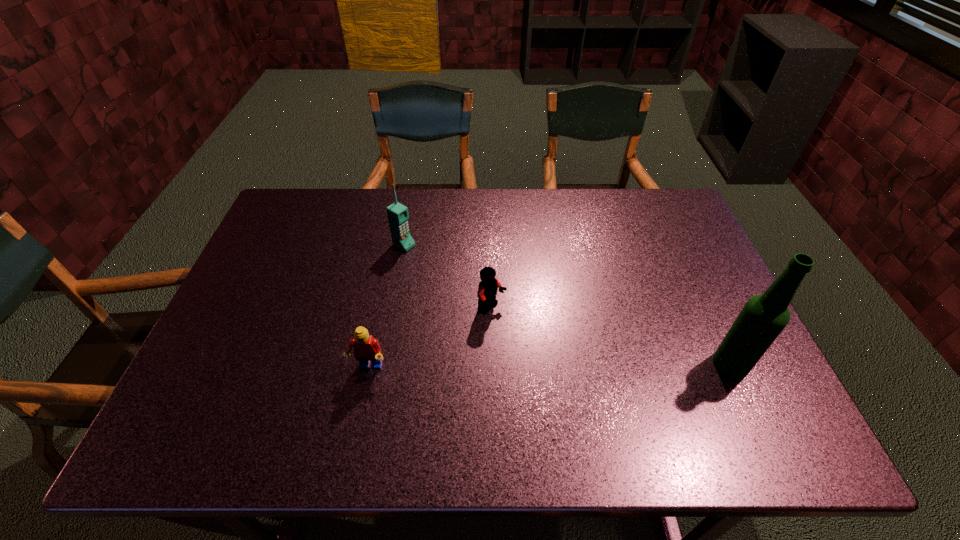
Find the location of `free space located 0.170m on the keypad of the cellular telephone`. free space located 0.170m on the keypad of the cellular telephone is located at coordinates (454, 275).

Find the location of a particular element. free space located on the front-facing side of the right Lego is located at coordinates (588, 382).

The image size is (960, 540). Find the location of `free point located on the front-facing side of the right Lego`. free point located on the front-facing side of the right Lego is located at coordinates (538, 345).

Find the location of a particular element. This screenshot has height=540, width=960. vacant space located on the front-facing side of the right Lego is located at coordinates (516, 328).

You are a GUI agent. You are given a task and a screenshot of the screen. Output one action in this format:
    pyautogui.click(x=<x>, y=<y>)
    Task: Click on the Lego located in the near edge section of the desktop
    Image resolution: width=960 pixels, height=540 pixels.
    Given the screenshot: What is the action you would take?
    pyautogui.click(x=366, y=348)

Identify the location of beer bottle that is at the near edge. The width and height of the screenshot is (960, 540). (763, 317).

Identify the location of object at the right edge. The width and height of the screenshot is (960, 540). [x=763, y=317].

Where is `object that is at the near right corner`? object that is at the near right corner is located at coordinates (763, 317).

The image size is (960, 540). In the image, there is a desktop. Find the location of `vacant space at the far edge`. vacant space at the far edge is located at coordinates (532, 227).

Find the location of a particular element. The width and height of the screenshot is (960, 540). free space at the near edge of the desktop is located at coordinates (333, 388).